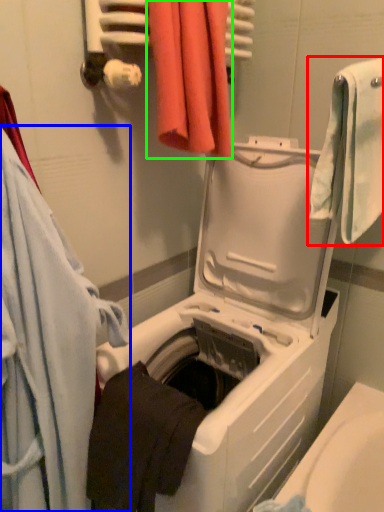
Question: Which object is positioned closest to towel (highlighted by a red box)? Select from towel (highlighted by a blue box) and towel (highlighted by a green box).

Choices:
 (A) towel
 (B) towel

Answer: (B)